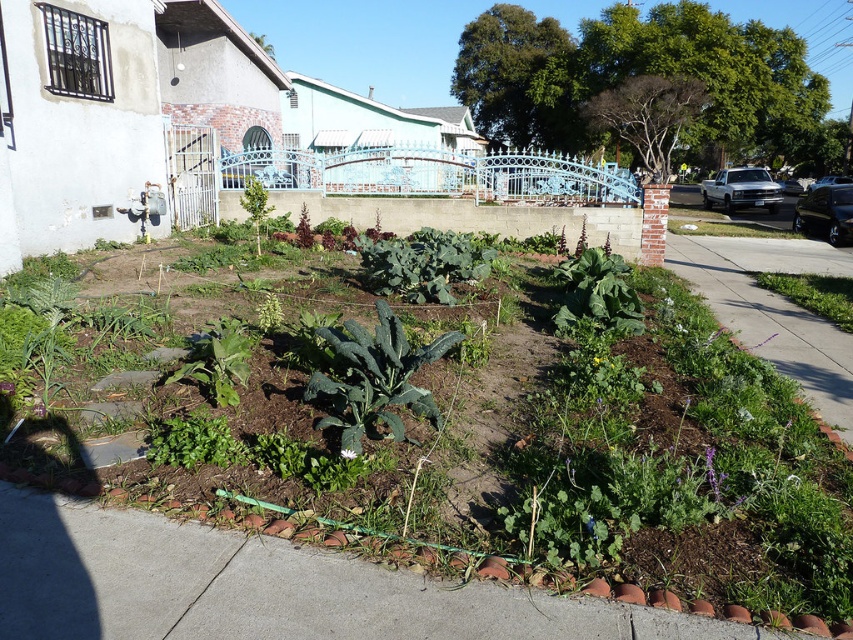
You are a gardener who needs to water the green leafy vegetables at center and the green grass at lower right. Your watering can holds 5 liters and you can carry it 6 meters before needing to refill. Can you water both areas without refilling?

The distance between the green leafy vegetables at center and the green grass at lower right is 5.95 meters, so yes, you can water both areas without refilling since the distance is within the 6 meters your watering can allows.

You are a gardener who wants to plant a new row of herbs between the green leafy vegetables at center and the decorative blue metal fence. Based on their positions, can you determine if there is enough space to plant the herbs in a straight line between them?

The green leafy vegetables at center is located at point (518, 468). Since the exact coordinates of the decorative blue metal fence are not provided, it is impossible to determine the distance between them. Therefore, you cannot confirm if there is enough space to plant the herbs in a straight line between them without additional information.